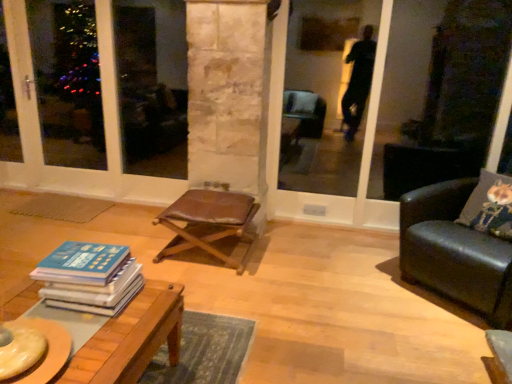
Identify the location of vacant space in front of leather stool at center. (219, 292).